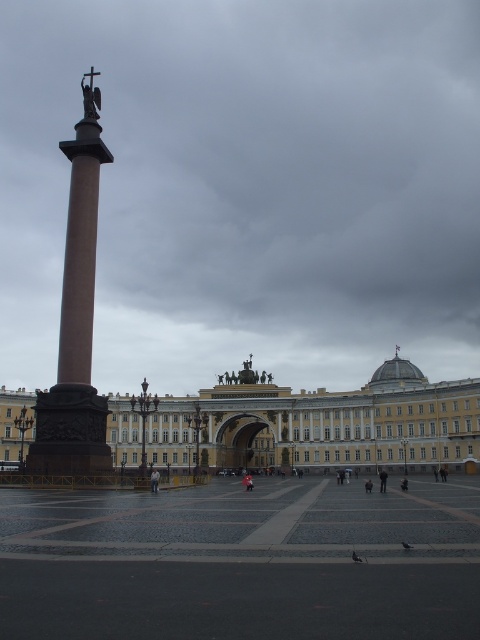
You are standing in the urban square and want to take a photo of the bronze statue at center. Considering the statue is 143.55 meters away from you, will you need a telephoto lens to capture the statue in detail?

The bronze statue at center is 143.55 meters away from the viewer, so a telephoto lens would be necessary to capture the statue in detail from that distance.

You are a tourist standing in the square and want to take a photo of the gray feathered pigeon at lower center while also including the smooth stone plaza at center in the frame. Which direction should you move to ensure both are visible?

The smooth stone plaza at center is to the left of the gray feathered pigeon at lower center, so you should move to the right to include both in your photo.